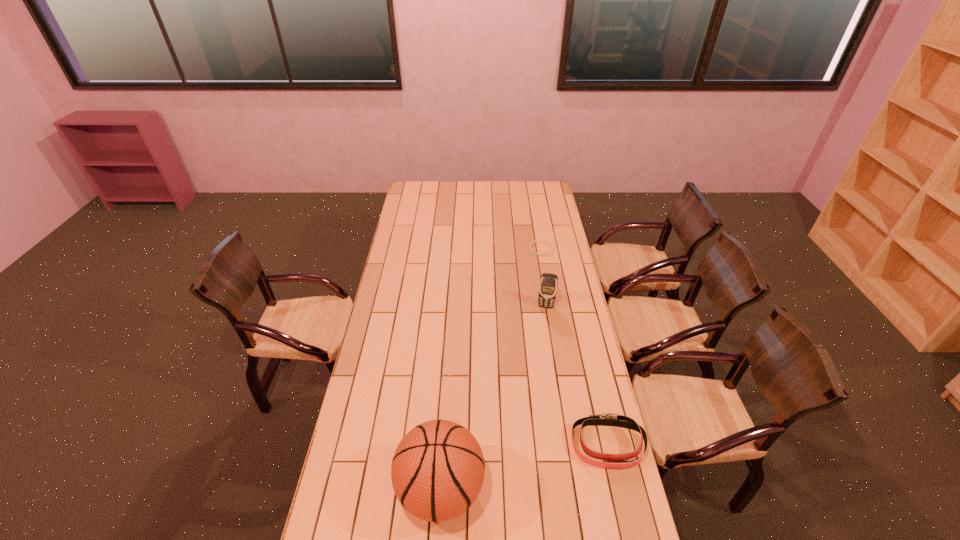
Identify the location of the leftmost object. The image size is (960, 540). (437, 472).

In order to click on basketball in this screenshot , I will do `click(437, 472)`.

Locate an element on the screen. dog collar is located at coordinates (606, 419).

Locate an element on the screen. the farthest object is located at coordinates (551, 245).

Find the location of `the shortest object`. the shortest object is located at coordinates (551, 245).

This screenshot has height=540, width=960. What are the coordinates of `the second farthest object` in the screenshot? It's located at (548, 285).

Where is `cellular telephone`? This screenshot has height=540, width=960. cellular telephone is located at coordinates (548, 285).

This screenshot has width=960, height=540. Identify the location of vacant area located 0.060m on the side where the inflation valve is located. (378, 490).

You are a GUI agent. You are given a task and a screenshot of the screen. Output one action in this format:
    pyautogui.click(x=<x>, y=<y>)
    Task: Click on the free space located on the side where the inflation valve is located
    This screenshot has height=540, width=960.
    Given the screenshot: What is the action you would take?
    pyautogui.click(x=350, y=490)

The image size is (960, 540). What are the coordinates of `free space located on the side where the inflation valve is located` in the screenshot? It's located at (366, 490).